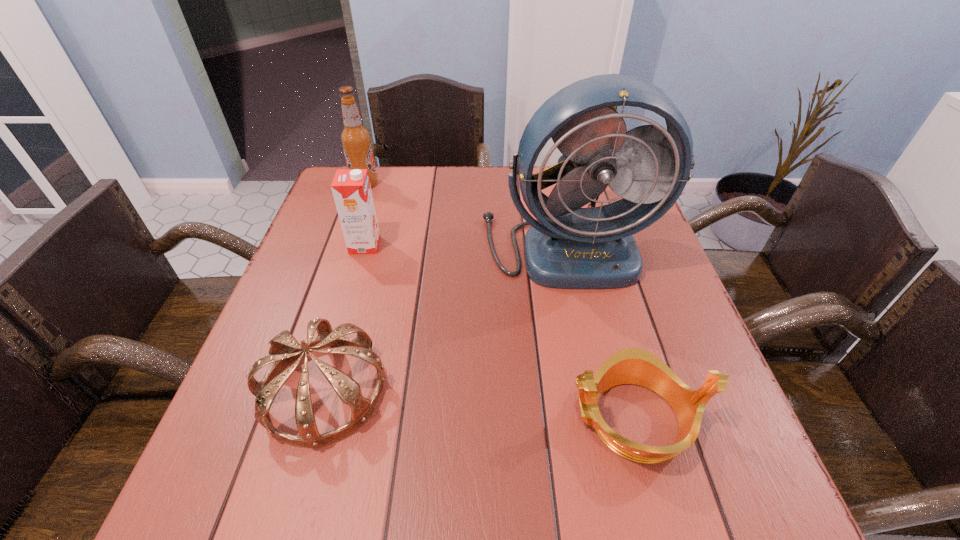
This screenshot has width=960, height=540. I want to click on vacant space located at the front emblem of the right tiara, so click(377, 418).

This screenshot has width=960, height=540. Identify the location of free space located 0.050m at the front emblem of the right tiara. (538, 418).

Where is `free location located 0.360m at the front emblem of the right tiara`? free location located 0.360m at the front emblem of the right tiara is located at coordinates (361, 418).

Find the location of a particular element. object that is at the far edge is located at coordinates (356, 140).

Locate an element on the screen. This screenshot has width=960, height=540. object present at the near edge is located at coordinates (636, 366).

What are the coordinates of `beer bottle that is positioned at the left edge` in the screenshot? It's located at (356, 140).

Locate an element on the screen. Image resolution: width=960 pixels, height=540 pixels. carton present at the left edge is located at coordinates (351, 189).

Locate an element on the screen. This screenshot has width=960, height=540. tiara located in the left edge section of the desktop is located at coordinates (284, 349).

Locate an element on the screen. fan present at the right edge is located at coordinates (568, 247).

Image resolution: width=960 pixels, height=540 pixels. I want to click on tiara present at the right edge, so click(x=636, y=366).